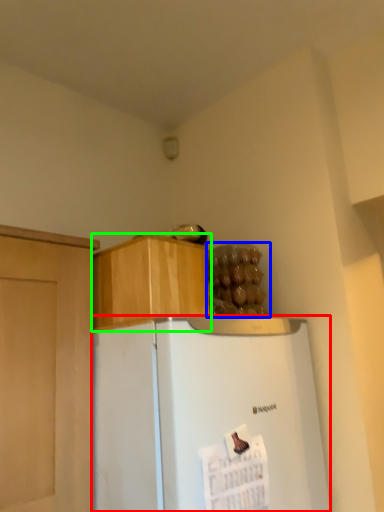
Question: Which is nearer to the refrigerator (highlighted by a red box)? food (highlighted by a blue box) or cabinetry (highlighted by a green box).

Choices:
 (A) food
 (B) cabinetry

Answer: (B)